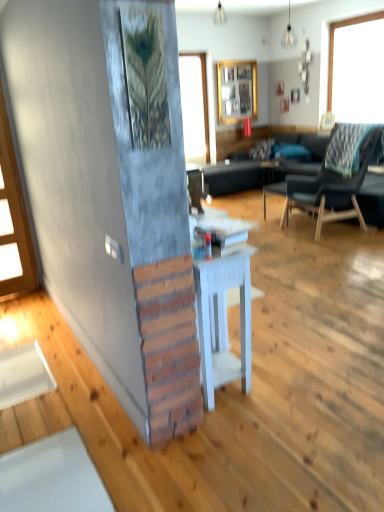
Question: From the image's perspective, relative to dark gray fabric chair at right, is wooden picture frame at upper right above or below?

Choices:
 (A) above
 (B) below

Answer: (A)

Question: In terms of width, does wooden picture frame at upper right look wider or thinner when compared to dark gray fabric chair at right?

Choices:
 (A) thin
 (B) wide

Answer: (A)

Question: Which object is positioned farthest from the matte white lampshade at upper center, the first lamp in the top-to-bottom sequence?

Choices:
 (A) white painted wood table at center
 (B) blue fabric pillow at center
 (C) dark gray fabric chair at right
 (D) wooden picture frame at upper right
 (E) matte glass bulb at upper center, acting as the 1th lamp starting from the front

Answer: (A)

Question: Which is nearer to the dark gray fabric chair at right?

Choices:
 (A) clear glass window at upper center
 (B) wooden picture frame at upper right
 (C) matte white lampshade at upper center, which is counted as the 1th lamp, starting from the left
 (D) white wood side table at center
 (E) wooden frame at upper center

Answer: (B)